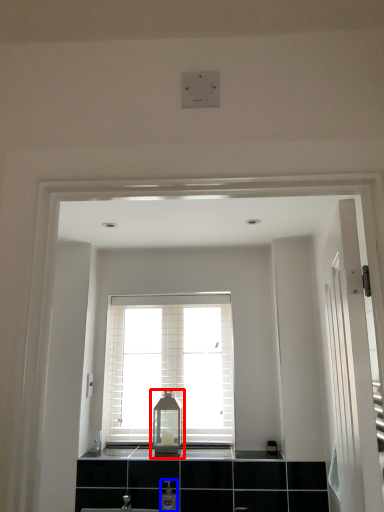
Question: Which object appears farthest to the camera in this image, medicine cabinet (highlighted by a red box) or toiletry (highlighted by a blue box)?

Choices:
 (A) medicine cabinet
 (B) toiletry

Answer: (A)